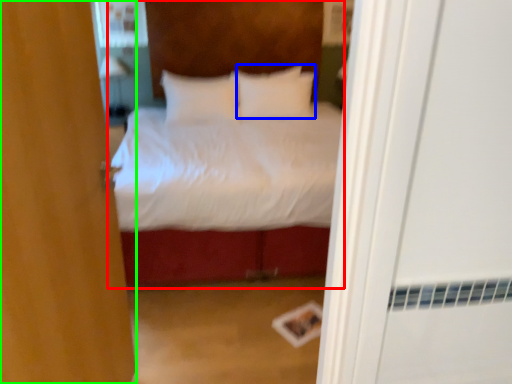
Question: Based on their relative distances, which object is farther from bed (highlighted by a red box)? Choose from pillow (highlighted by a blue box) and door (highlighted by a green box).

Choices:
 (A) pillow
 (B) door

Answer: (B)